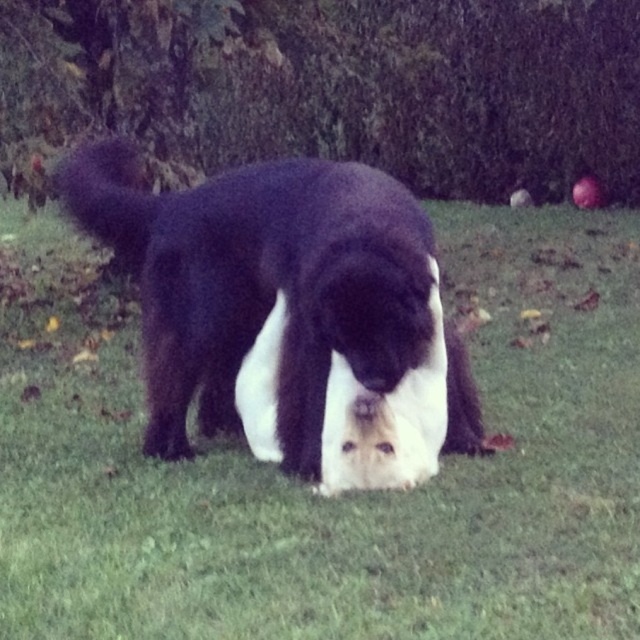
Between green grass at center and black fur dog at center, which one is positioned higher?

black fur dog at center

Which of these two, green grass at center or black fur dog at center, stands taller?

black fur dog at center

Is point (628, 296) positioned after point (202, 388)?

Yes.

This screenshot has height=640, width=640. Identify the location of green grass at center. (305, 486).